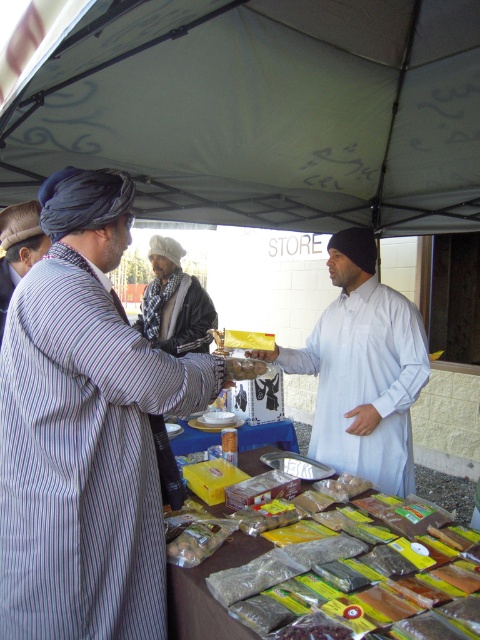
Can you confirm if striped fabric coat at left is taller than translucent plastic bags at center?

Indeed, striped fabric coat at left has a greater height compared to translucent plastic bags at center.

Is point (139, 536) positioned after point (288, 627)?

That is True.

The image size is (480, 640). Describe the element at coordinates (84, 429) in the screenshot. I see `striped fabric coat at left` at that location.

The width and height of the screenshot is (480, 640). What are the coordinates of `striped fabric coat at left` in the screenshot? It's located at (84, 429).

Which is in front, point (184, 4) or point (348, 349)?

Point (184, 4)

Is white fabric canopy at upper center thinner than white matte shirt at center?

No.

Which is in front, point (254, 8) or point (398, 355)?

Point (398, 355) is in front.

Locate an element on the screen. The image size is (480, 640). white fabric canopy at upper center is located at coordinates (264, 112).

Who is lower down, translucent plastic bags at center or striped fabric headscarf at left?

translucent plastic bags at center is lower down.

Is point (312, 564) positioned before point (33, 259)?

Yes, point (312, 564) is closer to viewer.

Image resolution: width=480 pixels, height=640 pixels. Find the location of `translucent plastic bags at center`. translucent plastic bags at center is located at coordinates (382, 572).